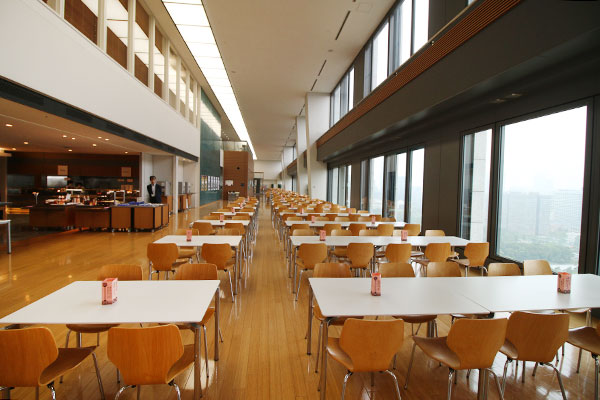
At what (x,y) coordinates should I click in order to perform the action: click on lower windows. Please return your answer as a coordinate pair (x, y). Looking at the image, I should click on (539, 195), (477, 189), (416, 185), (399, 188), (370, 188), (348, 187), (334, 186).